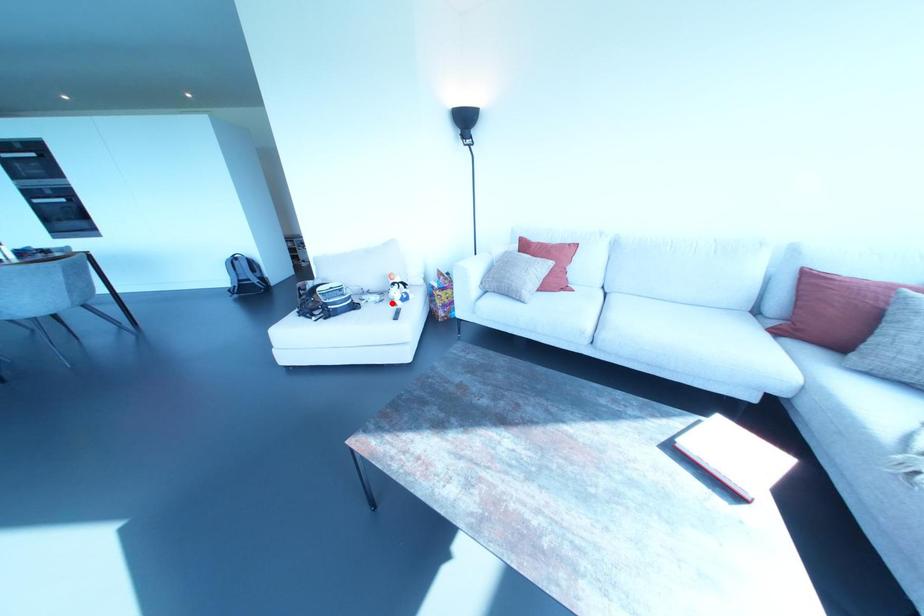
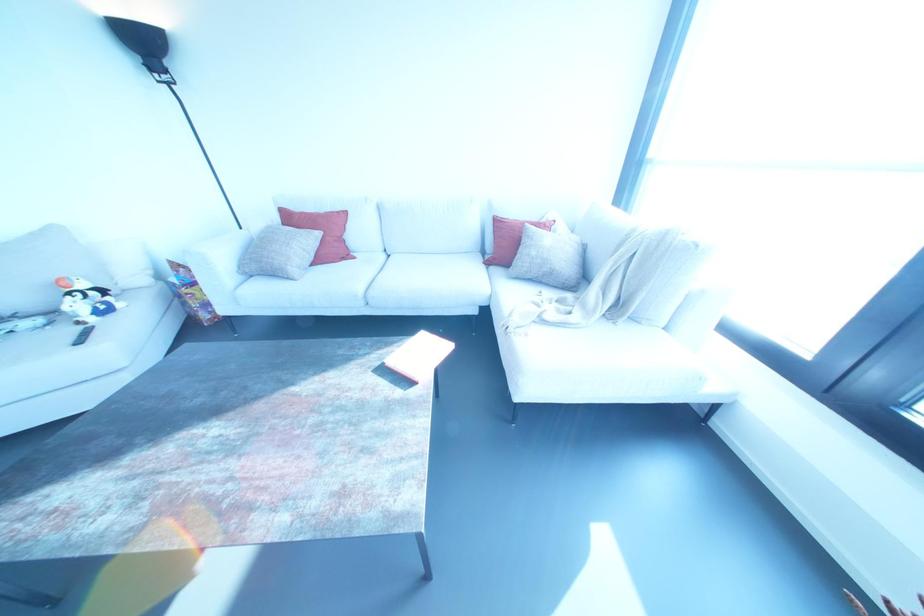
Find the pixel in the second image that matches the highlighted location in the first image.

(78, 322)